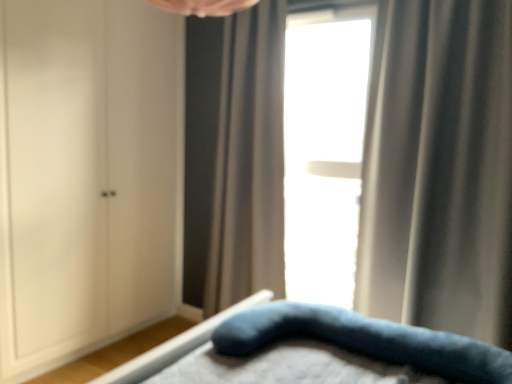
Question: From the image's perspective, is white matte cabinet at left positioned above or below transparent glass window at center?

Choices:
 (A) below
 (B) above

Answer: (A)

Question: From a real-world perspective, is white matte cabinet at left above or below transparent glass window at center?

Choices:
 (A) below
 (B) above

Answer: (A)

Question: Considering the real-world distances, which object is farthest from the transparent glass window at center?

Choices:
 (A) silky gray curtain at right, the first curtain from the right
 (B) velvety blue pillow at lower center
 (C) gray textured curtain at center, arranged as the 2th curtain when viewed from the front
 (D) white matte cabinet at left

Answer: (B)

Question: Which is nearer to the velvety blue pillow at lower center?

Choices:
 (A) gray textured curtain at center, which is counted as the 2th curtain, starting from the right
 (B) transparent glass window at center
 (C) silky gray curtain at right, placed as the first curtain when sorted from front to back
 (D) white matte cabinet at left

Answer: (C)